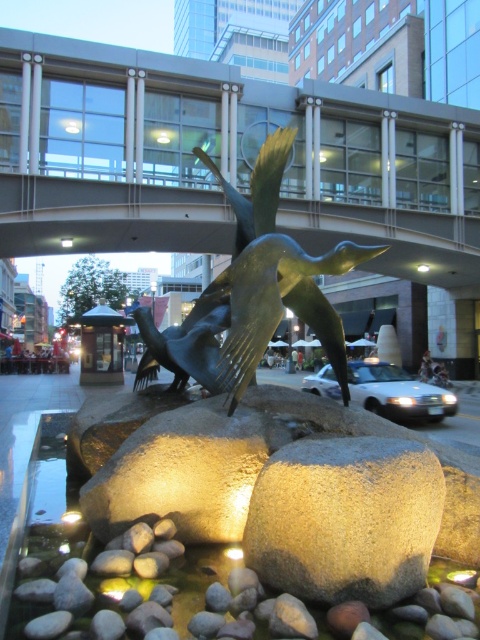
You are standing in front of the public sculpture and want to place a small flowerpot between the smooth gray rock at center and the bronze sculpture at center. Based on their positions, which object should the flowerpot be closer to?

The smooth gray rock at center is to the left of the bronze sculpture at center, so the flowerpot should be placed closer to the bronze sculpture at center to be between them.

You are standing at the entrance of the sculpture garden and see two points marked in the image. Which point, point (x=298, y=518) or point (x=144, y=380), is closer to you?

Point (x=298, y=518) is closer to you because it is in front of point (x=144, y=380).